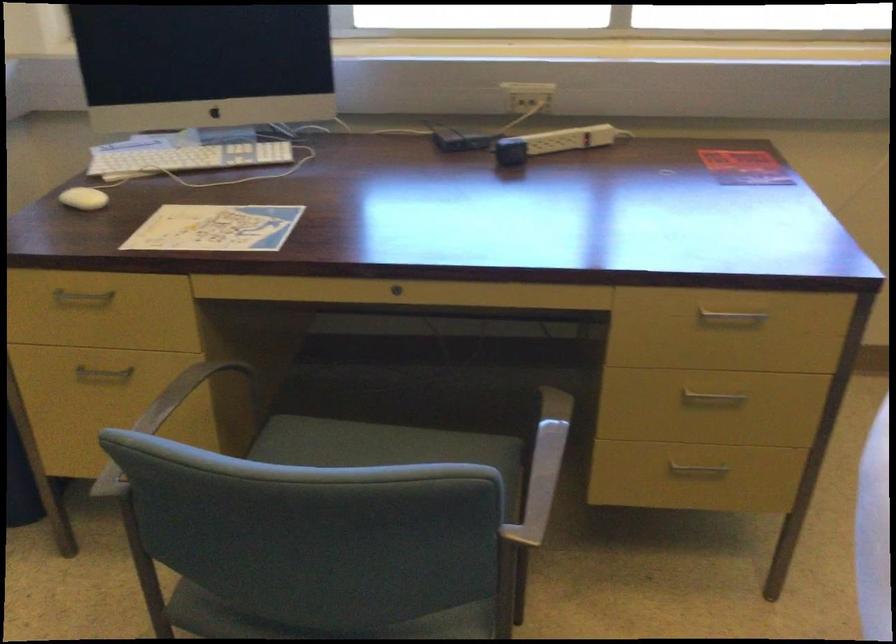
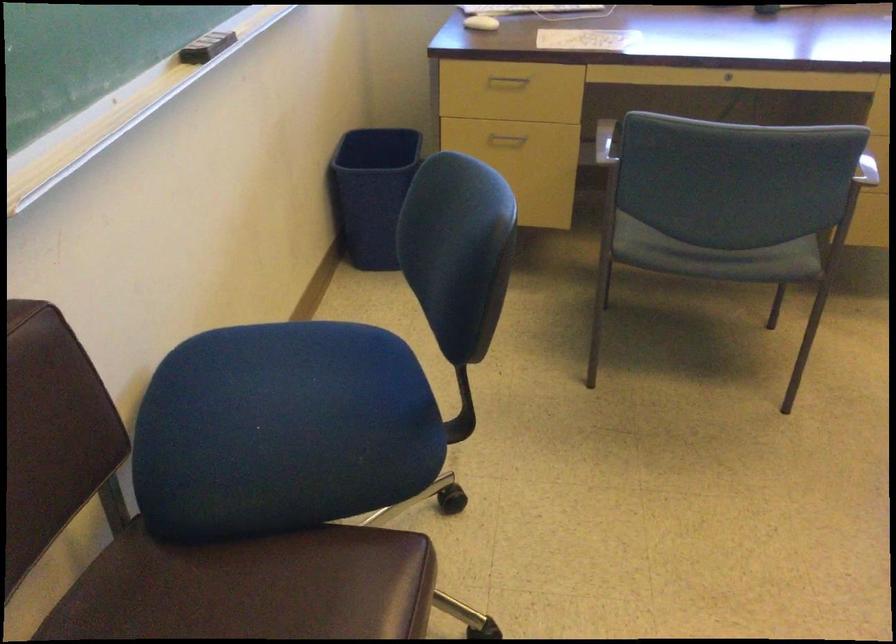
The images are taken continuously from a first-person perspective. In which direction are you moving?

The cameraman walked toward left, backward.